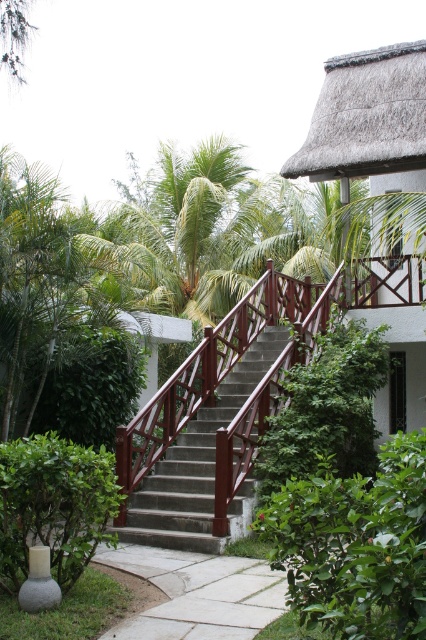
Is thatched roof hut at upper right further to camera compared to smooth concrete stairs at center?

Yes, thatched roof hut at upper right is further from the viewer.

Which is in front, point (405, 86) or point (239, 364)?

Point (239, 364)

The height and width of the screenshot is (640, 426). I want to click on thatched roof hut at upper right, so click(x=367, y=116).

This screenshot has height=640, width=426. What do you see at coordinates (354, 545) in the screenshot?
I see `green leafy bush at lower right` at bounding box center [354, 545].

Which is in front, point (420, 552) or point (227, 406)?

Point (420, 552) is in front.

Where is `green leafy bush at lower right`? green leafy bush at lower right is located at coordinates pos(354,545).

Does green leafy bush at lower left lie behind smooth concrete stairs at center?

No, green leafy bush at lower left is closer to the viewer.

Between point (69, 493) and point (229, 413), which one is positioned behind?

Point (229, 413)

I want to click on green leafy bush at lower left, so click(54, 506).